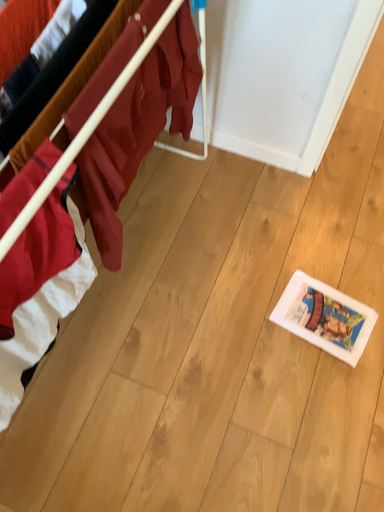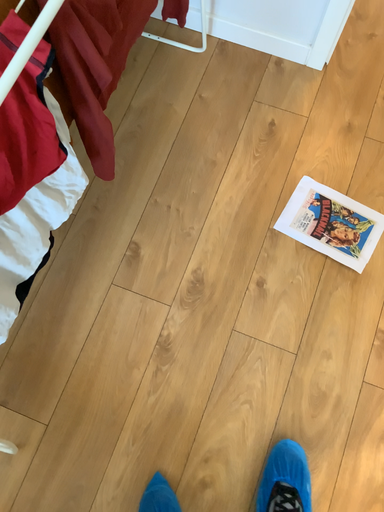
Question: Which way did the camera rotate in the video?

Choices:
 (A) rotated upward
 (B) rotated downward

Answer: (B)